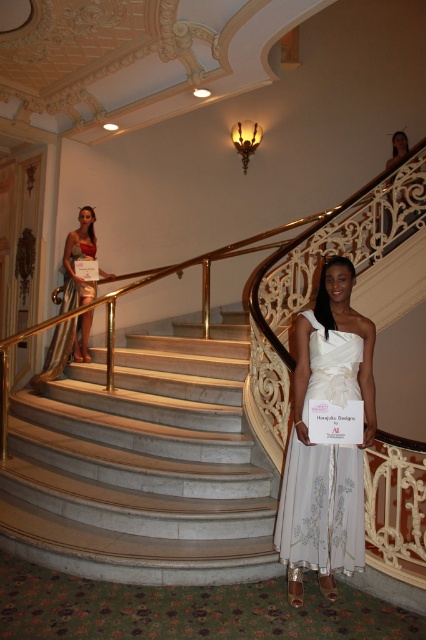
Does white satin dress at center have a greater width compared to gold metallic dress at upper left?

No.

Describe the element at coordinates (322, 465) in the screenshot. I see `white satin dress at center` at that location.

The width and height of the screenshot is (426, 640). Find the location of `white satin dress at center`. white satin dress at center is located at coordinates (322, 465).

Is white marble stairs at center above gold metallic dress at upper left?

No.

Who is lower down, white marble stairs at center or gold metallic dress at upper left?

white marble stairs at center is lower down.

Does point (103, 413) come behind point (45, 365)?

No.

Where is `white marble stairs at center`? The height and width of the screenshot is (640, 426). white marble stairs at center is located at coordinates (143, 465).

Which of these two, white marble stairs at center or shiny gold dress at upper left, stands taller?

With more height is shiny gold dress at upper left.

Based on the photo, between white marble stairs at center and shiny gold dress at upper left, which one has less height?

With less height is white marble stairs at center.

Based on the photo, measure the distance between white marble stairs at center and camera.

white marble stairs at center and camera are 2.85 meters apart.

Where is `white marble stairs at center`? The image size is (426, 640). white marble stairs at center is located at coordinates pyautogui.click(x=143, y=465).